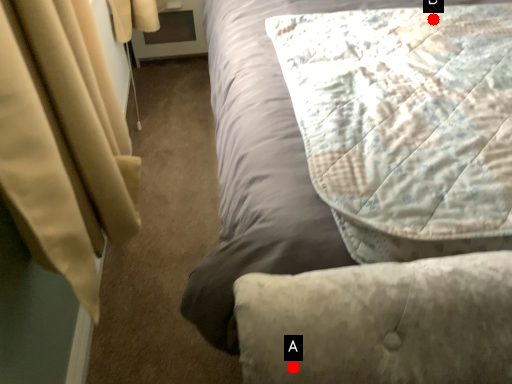
Question: Two points are circled on the image, labeled by A and B beside each circle. Which point is further to the camera?

Choices:
 (A) A is further
 (B) B is further

Answer: (B)